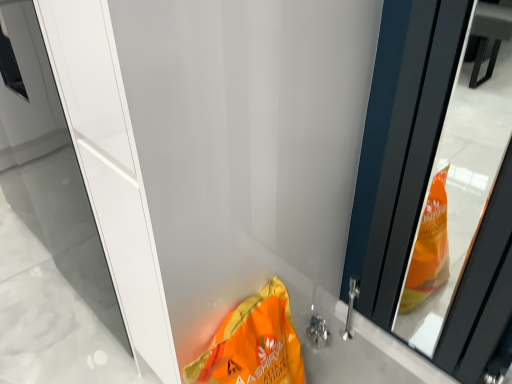
Question: Can you confirm if orange matte bag at lower center is wider than white glossy screen door at center?

Choices:
 (A) yes
 (B) no

Answer: (B)

Question: Is orange matte bag at lower center bigger than white glossy screen door at center?

Choices:
 (A) no
 (B) yes

Answer: (A)

Question: Is white glossy screen door at center completely or partially inside orange matte bag at lower center?

Choices:
 (A) no
 (B) yes

Answer: (A)

Question: Considering the relative positions of orange matte bag at lower center and white glossy screen door at center in the image provided, is orange matte bag at lower center to the left of white glossy screen door at center from the viewer's perspective?

Choices:
 (A) no
 (B) yes

Answer: (A)

Question: Is the depth of orange matte bag at lower center less than that of white glossy screen door at center?

Choices:
 (A) yes
 (B) no

Answer: (B)

Question: From a real-world perspective, is orange matte bag at lower center over white glossy screen door at center?

Choices:
 (A) yes
 (B) no

Answer: (B)

Question: Is white glossy screen door at center placed right next to orange matte bag at lower center?

Choices:
 (A) no
 (B) yes

Answer: (A)

Question: Does white glossy screen door at center have a lesser height compared to orange matte bag at lower center?

Choices:
 (A) no
 (B) yes

Answer: (A)

Question: Can you confirm if white glossy screen door at center is positioned to the right of orange matte bag at lower center?

Choices:
 (A) no
 (B) yes

Answer: (A)

Question: Considering the relative sizes of white glossy screen door at center and orange matte bag at lower center in the image provided, is white glossy screen door at center wider than orange matte bag at lower center?

Choices:
 (A) no
 (B) yes

Answer: (B)

Question: From the image's perspective, is white glossy screen door at center above orange matte bag at lower center?

Choices:
 (A) yes
 (B) no

Answer: (A)

Question: Does white glossy screen door at center contain orange matte bag at lower center?

Choices:
 (A) no
 (B) yes

Answer: (A)

Question: Is white glossy screen door at center inside or outside of orange matte bag at lower center?

Choices:
 (A) inside
 (B) outside

Answer: (B)